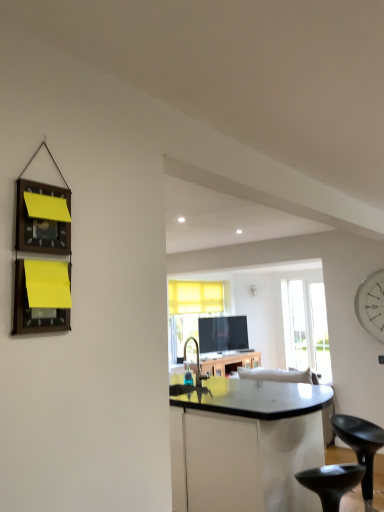
Question: Can you confirm if transparent glass door at center is wider than black plastic stool at lower right, the second stool in the left-to-right sequence?

Choices:
 (A) no
 (B) yes

Answer: (A)

Question: Is transparent glass door at center aimed at black plastic stool at lower right, the second stool in the left-to-right sequence?

Choices:
 (A) yes
 (B) no

Answer: (B)

Question: Is transparent glass door at center to the left of black plastic stool at lower right, placed as the 1th stool when sorted from right to left, from the viewer's perspective?

Choices:
 (A) yes
 (B) no

Answer: (B)

Question: Does transparent glass door at center have a smaller size compared to black plastic stool at lower right, the second stool in the left-to-right sequence?

Choices:
 (A) yes
 (B) no

Answer: (A)

Question: From the image's perspective, is transparent glass door at center above black plastic stool at lower right, placed as the 1th stool when sorted from right to left?

Choices:
 (A) yes
 (B) no

Answer: (A)

Question: In terms of height, does white glossy clock at right look taller or shorter compared to transparent glass door at center?

Choices:
 (A) tall
 (B) short

Answer: (B)

Question: In terms of width, does white glossy clock at right look wider or thinner when compared to transparent glass door at center?

Choices:
 (A) wide
 (B) thin

Answer: (B)

Question: Do you think white glossy clock at right is within transparent glass door at center, or outside of it?

Choices:
 (A) outside
 (B) inside

Answer: (A)

Question: Based on their positions, is white glossy clock at right located to the left or right of transparent glass door at center?

Choices:
 (A) left
 (B) right

Answer: (A)

Question: From the image's perspective, is white glossy clock at right above or below matte silver faucet at center?

Choices:
 (A) above
 (B) below

Answer: (A)

Question: From a real-world perspective, relative to matte silver faucet at center, is white glossy clock at right vertically above or below?

Choices:
 (A) below
 (B) above

Answer: (B)

Question: In terms of width, does white glossy clock at right look wider or thinner when compared to matte silver faucet at center?

Choices:
 (A) wide
 (B) thin

Answer: (B)

Question: Relative to matte silver faucet at center, is white glossy clock at right in front or behind?

Choices:
 (A) behind
 (B) front

Answer: (A)

Question: From their relative heights in the image, would you say black plastic stool at lower right, the 2th stool from the right, is taller or shorter than white glossy clock at right?

Choices:
 (A) tall
 (B) short

Answer: (B)

Question: Is point (296, 480) positioned closer to the camera than point (362, 318)?

Choices:
 (A) closer
 (B) farther

Answer: (A)